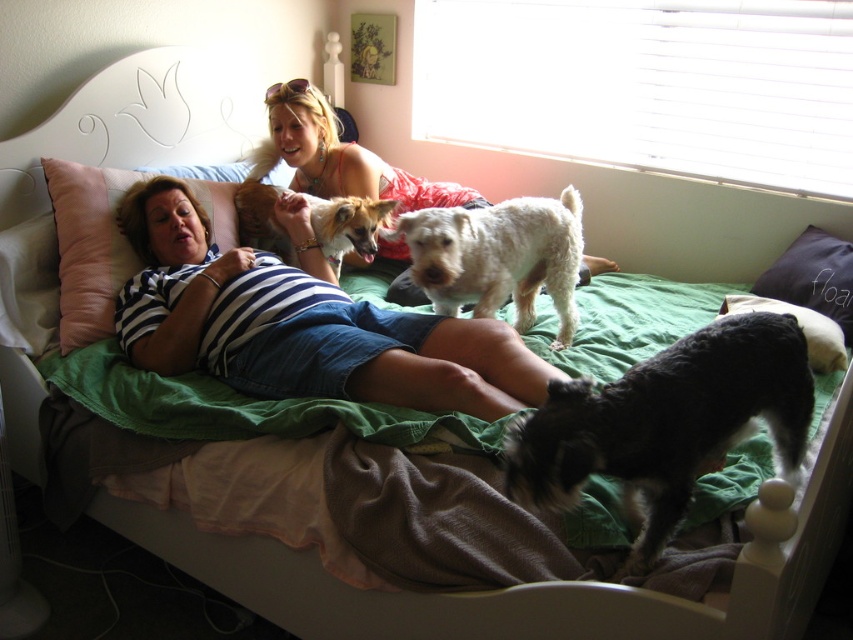
Does point (648, 371) come farther from viewer compared to point (454, 310)?

No, (648, 371) is in front of (454, 310).

Consider the image. Who is higher up, black fuzzy dog at lower right or white fluffy dog at center?

Positioned higher is white fluffy dog at center.

Is point (589, 401) less distant than point (518, 212)?

Yes.

You are a GUI agent. You are given a task and a screenshot of the screen. Output one action in this format:
    pyautogui.click(x=<x>, y=<y>)
    Task: Click on the black fuzzy dog at lower right
    This screenshot has width=853, height=640.
    Given the screenshot: What is the action you would take?
    pyautogui.click(x=666, y=422)

Between pink fabric pillow at left and matte pink dress at center, which one has less height?

Standing shorter between the two is pink fabric pillow at left.

Is point (93, 296) farther from camera compared to point (426, 182)?

No, (93, 296) is in front of (426, 182).

This screenshot has height=640, width=853. What do you see at coordinates (88, 248) in the screenshot? I see `pink fabric pillow at left` at bounding box center [88, 248].

At what (x,y) coordinates should I click in order to perform the action: click on pink fabric pillow at left. Please return your answer as a coordinate pair (x, y). The image size is (853, 640). Looking at the image, I should click on (88, 248).

Can you confirm if pink fabric pillow at left is shorter than green fabric pillow at upper center?

Incorrect, pink fabric pillow at left's height does not fall short of green fabric pillow at upper center's.

The image size is (853, 640). Find the location of `pink fabric pillow at left`. pink fabric pillow at left is located at coordinates coord(88,248).